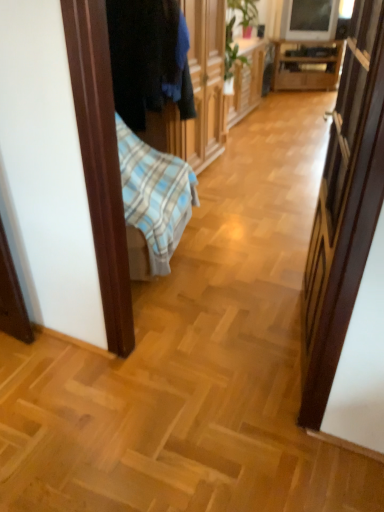
Measure the distance between wooden cabinet at center and camera.

4.10 meters.

Find the location of a particular element. Image resolution: width=384 pixels, height=512 pixels. dark blue fabric at left is located at coordinates (148, 59).

What do you see at coordinates (148, 59) in the screenshot? I see `dark blue fabric at left` at bounding box center [148, 59].

I want to click on wooden cabinet at center, so click(306, 65).

Is wooden cabinet at center shorter than wooden cabinet at center?

Yes, wooden cabinet at center is shorter than wooden cabinet at center.

Is wooden cabinet at center touching wooden cabinet at center?

No, wooden cabinet at center is not touching wooden cabinet at center.

Is wooden cabinet at center behind wooden cabinet at center?

Yes, it is behind wooden cabinet at center.

Looking at this image, from a real-world perspective, is wooden cabinet at center below wooden cabinet at center?

Yes, from a real-world perspective, wooden cabinet at center is beneath wooden cabinet at center.

From a real-world perspective, is dark blue fabric at left positioned above or below wooden cabinet at center?

dark blue fabric at left is above wooden cabinet at center.

From the image's perspective, which is below, dark blue fabric at left or wooden cabinet at center?

dark blue fabric at left, from the image's perspective.

Considering the sizes of objects dark blue fabric at left and wooden cabinet at center in the image provided, who is bigger, dark blue fabric at left or wooden cabinet at center?

wooden cabinet at center.

The image size is (384, 512). What are the coordinates of `clothing above the wooden cabinet at center (from a real-world perspective)` in the screenshot? It's located at (148, 59).

Does wooden cabinet at center have a lesser width compared to dark blue fabric at left?

Correct, the width of wooden cabinet at center is less than that of dark blue fabric at left.

From a real-world perspective, is wooden cabinet at center above or below dark blue fabric at left?

Clearly, from a real-world perspective, wooden cabinet at center is below dark blue fabric at left.

Is wooden cabinet at center inside or outside of dark blue fabric at left?

wooden cabinet at center is located beyond the bounds of dark blue fabric at left.

Considering the sizes of objects dark blue fabric at left and wooden cabinet at center in the image provided, who is shorter, dark blue fabric at left or wooden cabinet at center?

wooden cabinet at center.

Measure the distance from dark blue fabric at left to wooden cabinet at center.

A distance of 1.60 meters exists between dark blue fabric at left and wooden cabinet at center.

Does dark blue fabric at left have a greater width compared to wooden cabinet at center?

Correct, the width of dark blue fabric at left exceeds that of wooden cabinet at center.

Is wooden cabinet at center placed right next to wooden cabinet at center?

wooden cabinet at center and wooden cabinet at center are not in contact.

Can you tell me how much wooden cabinet at center and wooden cabinet at center differ in facing direction?

There is a 62.8-degree angle between the facing directions of wooden cabinet at center and wooden cabinet at center.

Which of these two, wooden cabinet at center or wooden cabinet at center, is wider?

With larger width is wooden cabinet at center.

Considering the sizes of objects wooden cabinet at center and dark blue fabric at left in the image provided, who is thinner, wooden cabinet at center or dark blue fabric at left?

Thinner between the two is wooden cabinet at center.

Is wooden cabinet at center to the left or to the right of dark blue fabric at left in the image?

wooden cabinet at center is to the right of dark blue fabric at left.

Which is correct: wooden cabinet at center is inside dark blue fabric at left, or outside of it?

wooden cabinet at center is spatially situated outside dark blue fabric at left.

What's the angular difference between wooden cabinet at center and dark blue fabric at left's facing directions?

0.659 degrees separate the facing orientations of wooden cabinet at center and dark blue fabric at left.

This screenshot has height=512, width=384. What are the coordinates of `cabinetry above the wooden cabinet at center (from a real-world perspective)` in the screenshot? It's located at (246, 80).

Locate an element on the screen. The width and height of the screenshot is (384, 512). clothing in front of the wooden cabinet at center is located at coordinates pos(148,59).

Estimate the real-world distances between objects in this image. Which object is closer to dark blue fabric at left, wooden cabinet at center or wooden cabinet at center?

wooden cabinet at center lies closer to dark blue fabric at left than the other object.

Estimate the real-world distances between objects in this image. Which object is further from wooden cabinet at center, wooden cabinet at center or dark blue fabric at left?

dark blue fabric at left is further to wooden cabinet at center.

When comparing their distances from wooden cabinet at center, does wooden cabinet at center or dark blue fabric at left seem further?

Among the two, dark blue fabric at left is located further to wooden cabinet at center.

Consider the image. Estimate the real-world distances between objects in this image. Which object is further from wooden cabinet at center, dark blue fabric at left or wooden cabinet at center?

Based on the image, dark blue fabric at left appears to be further to wooden cabinet at center.

Considering their positions, is dark blue fabric at left positioned further to wooden cabinet at center than wooden cabinet at center?

dark blue fabric at left is further to wooden cabinet at center.

Which object lies further to the anchor point dark blue fabric at left, wooden cabinet at center or wooden cabinet at center?

Among the two, wooden cabinet at center is located further to dark blue fabric at left.

At what (x,y) coordinates should I click in order to perform the action: click on cabinetry between dark blue fabric at left and wooden cabinet at center along the z-axis. Please return your answer as a coordinate pair (x, y). The height and width of the screenshot is (512, 384). Looking at the image, I should click on (246, 80).